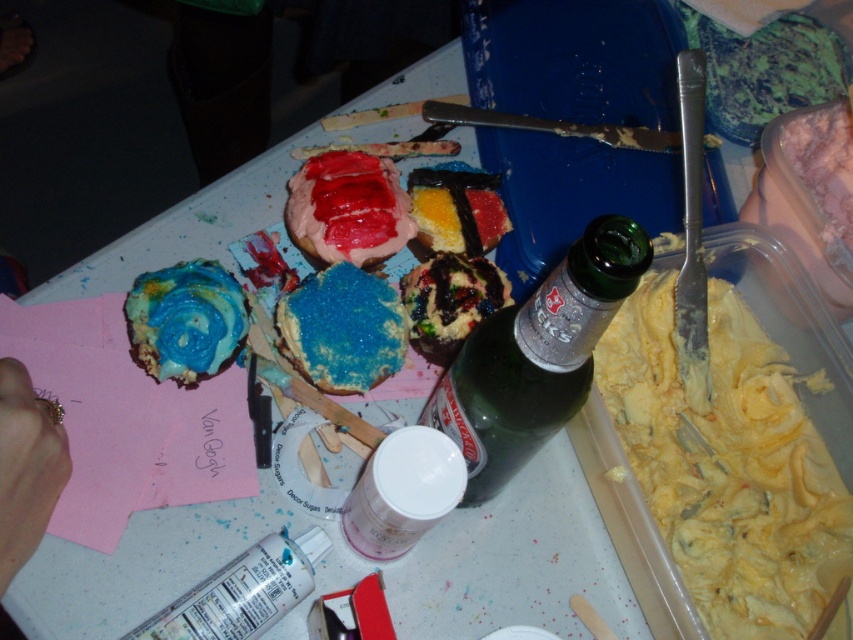
Question: Which point is closer to the camera?

Choices:
 (A) (172, 358)
 (B) (471, 376)
 (C) (35, 451)

Answer: (C)

Question: Is blue frosted pastry at center-left bigger than gold ring at lower left?

Choices:
 (A) no
 (B) yes

Answer: (A)

Question: Which object is positioned closest to the green glass bottle at center?

Choices:
 (A) blue frosted pastry at center-left
 (B) yellow creamy frosting at center right

Answer: (B)

Question: Which object is the closest to the blue frosted pastry at center-left?

Choices:
 (A) gold ring at lower left
 (B) yellow creamy frosting at center right

Answer: (A)

Question: Does yellow creamy frosting at center right have a larger size compared to blue frosted pastry at center-left?

Choices:
 (A) no
 (B) yes

Answer: (B)

Question: Is green glass bottle at center wider than blue frosted pastry at center-left?

Choices:
 (A) yes
 (B) no

Answer: (A)